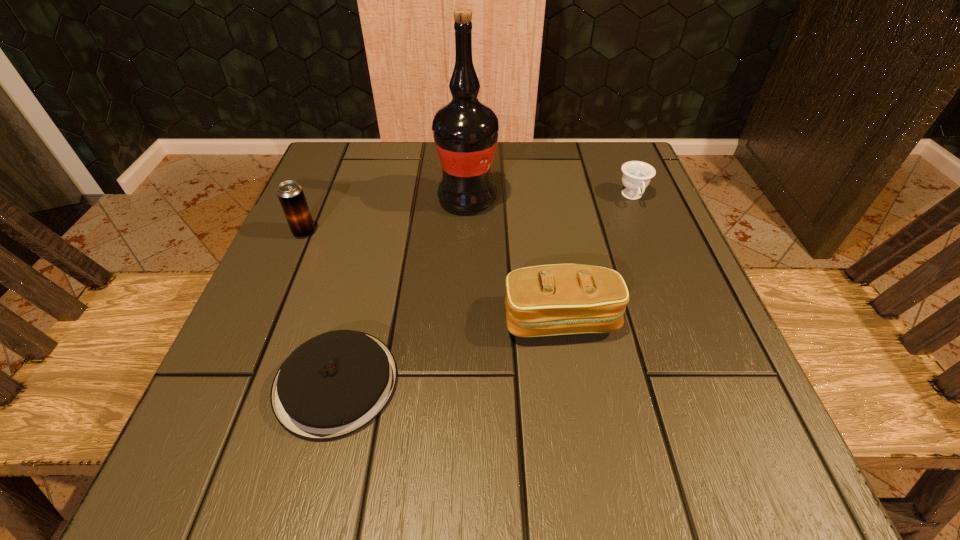
I want to click on clutch bag positioned at the right edge, so click(559, 299).

At what (x,y) coordinates should I click in order to perform the action: click on teacup positioned at the right edge. Please return your answer as a coordinate pair (x, y). The image size is (960, 540). Looking at the image, I should click on (636, 176).

Identify the location of object located at the near left corner. (332, 385).

This screenshot has width=960, height=540. Identify the location of object present at the far right corner. (636, 176).

In the image, there is a desktop. Identify the location of vacant space at the far edge. (533, 198).

In the image, there is a desktop. Where is `vacant space at the near edge`? vacant space at the near edge is located at coordinates click(x=633, y=470).

Where is `vacant space at the left edge`? vacant space at the left edge is located at coordinates (318, 237).

In the image, there is a desktop. At what (x,y) coordinates should I click in order to perform the action: click on blank space at the right edge. Please return your answer as a coordinate pair (x, y). Looking at the image, I should click on (631, 261).

The image size is (960, 540). I want to click on vacant region at the far left corner of the desktop, so click(347, 144).

In the image, there is a desktop. Where is `free region at the near left corner`? free region at the near left corner is located at coordinates (279, 456).